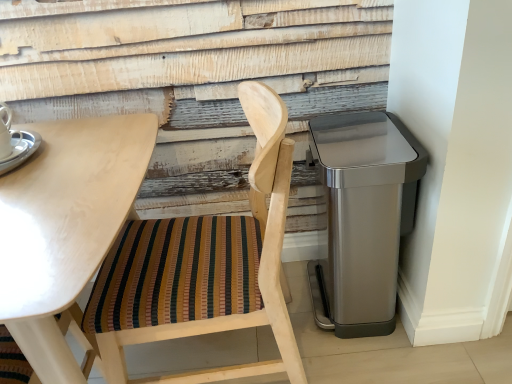
Question: Is wooden chair with striped cushion at left behind silver metallic saucer at upper left?

Choices:
 (A) no
 (B) yes

Answer: (A)

Question: Is wooden chair with striped cushion at left next to silver metallic saucer at upper left?

Choices:
 (A) no
 (B) yes

Answer: (A)

Question: Is wooden chair with striped cushion at left facing towards silver metallic saucer at upper left?

Choices:
 (A) no
 (B) yes

Answer: (B)

Question: Is wooden chair with striped cushion at left closer to the viewer compared to silver metallic saucer at upper left?

Choices:
 (A) no
 (B) yes

Answer: (B)

Question: Is wooden chair with striped cushion at left completely or partially outside of silver metallic saucer at upper left?

Choices:
 (A) yes
 (B) no

Answer: (A)

Question: Is satin silver trash can at right wider or thinner than wooden chair with striped cushion at left?

Choices:
 (A) thin
 (B) wide

Answer: (A)

Question: Considering their positions, is satin silver trash can at right located in front of or behind wooden chair with striped cushion at left?

Choices:
 (A) behind
 (B) front

Answer: (A)

Question: From a real-world perspective, relative to wooden chair with striped cushion at left, is satin silver trash can at right vertically above or below?

Choices:
 (A) below
 (B) above

Answer: (A)

Question: Is point (312, 299) closer or farther from the camera than point (260, 157)?

Choices:
 (A) closer
 (B) farther

Answer: (B)

Question: From a real-world perspective, is wooden chair with striped cushion at left physically located above or below light wood table at upper left?

Choices:
 (A) above
 (B) below

Answer: (A)

Question: Would you say wooden chair with striped cushion at left is to the left or to the right of light wood table at upper left in the picture?

Choices:
 (A) left
 (B) right

Answer: (B)

Question: In terms of width, does wooden chair with striped cushion at left look wider or thinner when compared to light wood table at upper left?

Choices:
 (A) thin
 (B) wide

Answer: (A)

Question: Would you say wooden chair with striped cushion at left is inside or outside light wood table at upper left?

Choices:
 (A) outside
 (B) inside

Answer: (A)

Question: Considering their positions, is satin silver trash can at right located in front of or behind silver metallic saucer at upper left?

Choices:
 (A) front
 (B) behind

Answer: (B)

Question: Considering the positions of satin silver trash can at right and silver metallic saucer at upper left in the image, is satin silver trash can at right wider or thinner than silver metallic saucer at upper left?

Choices:
 (A) thin
 (B) wide

Answer: (B)